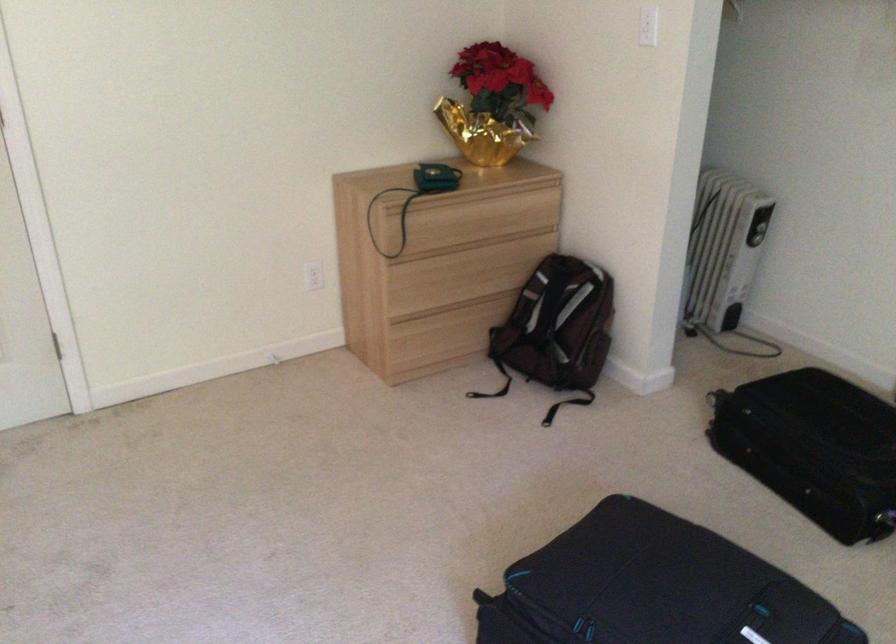
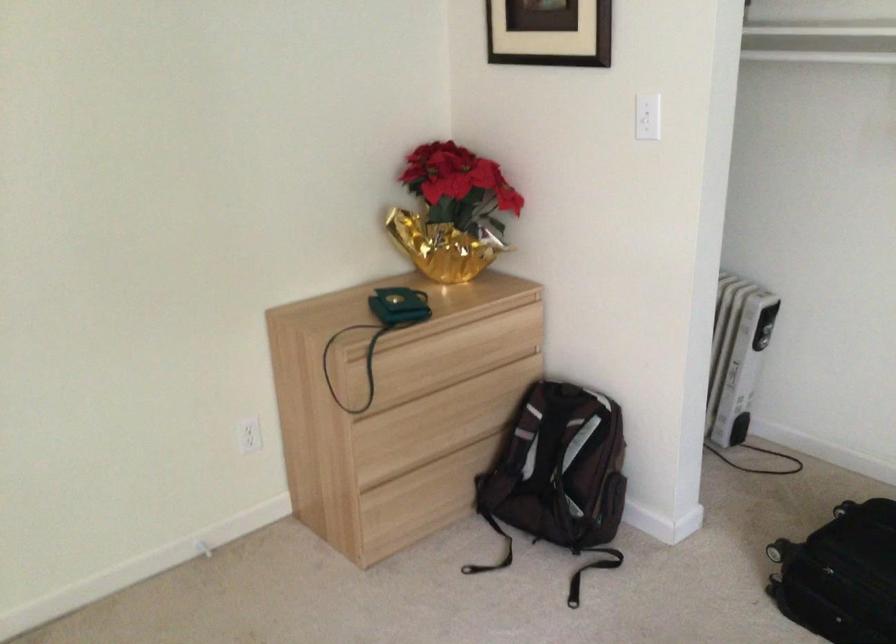
Where in the second image is the point corresponding to the point at 477,222 from the first image?

(454, 355)